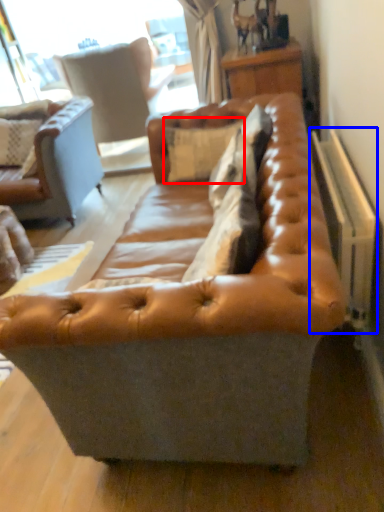
Question: Which object appears farthest to the camera in this image, pillow (highlighted by a red box) or radiator (highlighted by a blue box)?

Choices:
 (A) pillow
 (B) radiator

Answer: (A)